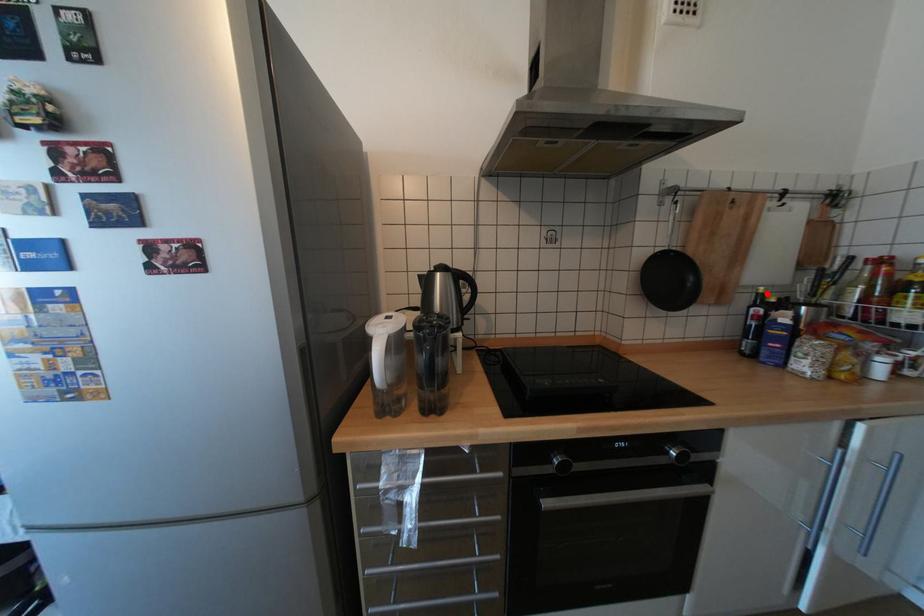
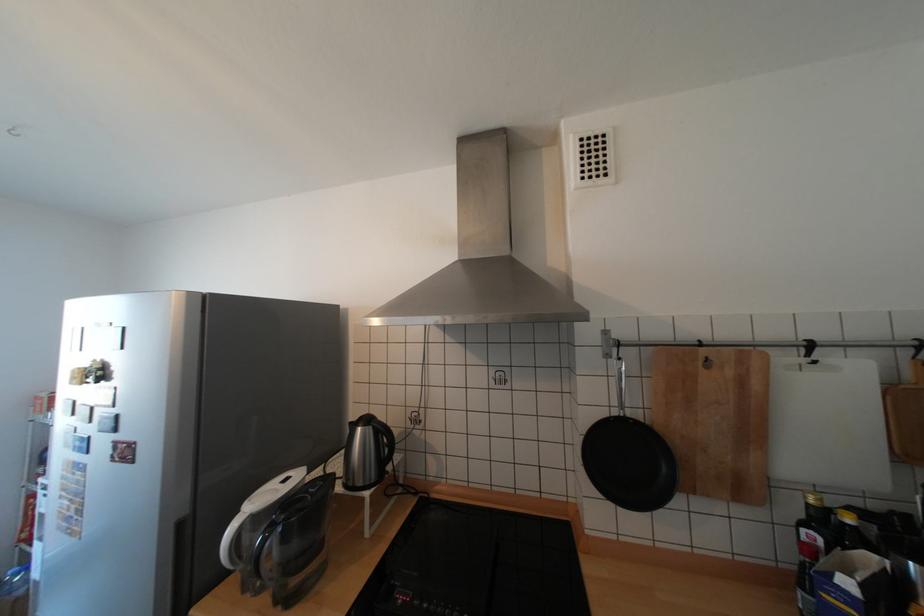
Locate, in the second image, the point that corresponds to the highlighted location in the first image.

(817, 505)